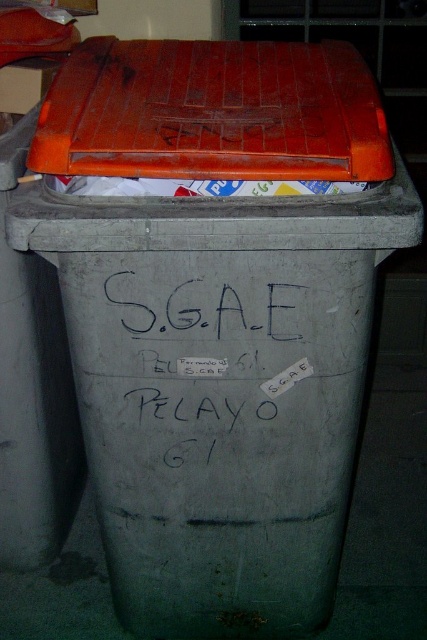
You are organizing items in a storage room and need to place a new label on the gray plastic trash bin. The label must go below the existing black matte writing at center. Where should you place the new label in relation to the orange plastic lid at upper center?

The new label should be placed below the black matte writing at center, which is under the orange plastic lid at upper center. Therefore, the new label will be positioned below the orange plastic lid at upper center.

You need to place a 12 inch ruler between the orange plastic lid at upper center and the black matte writing at center. Is there enough space for the ruler to fit between them?

The orange plastic lid at upper center is 13.16 inches away from the black matte writing at center, so yes, the 12 inch ruler can fit between them since the distance is greater than the ruler length.